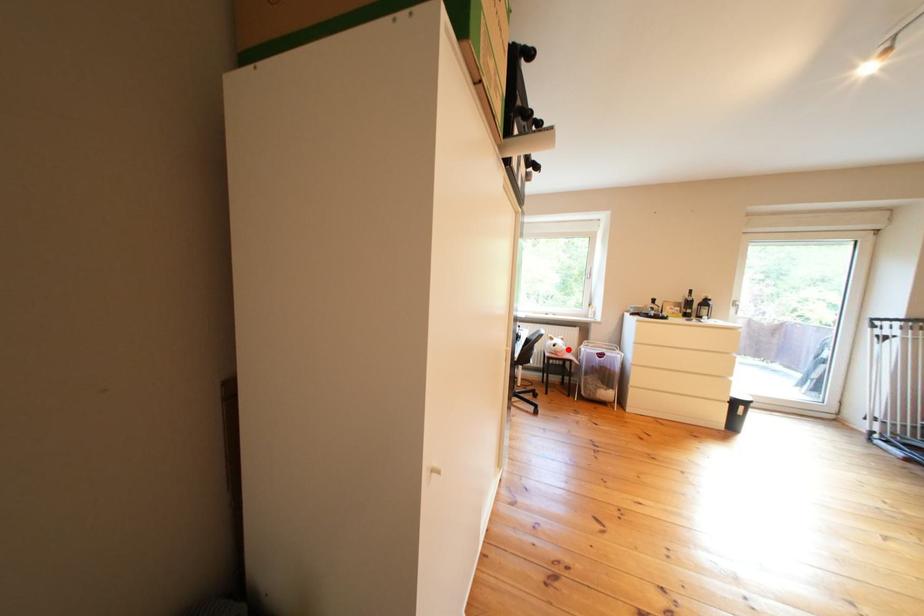
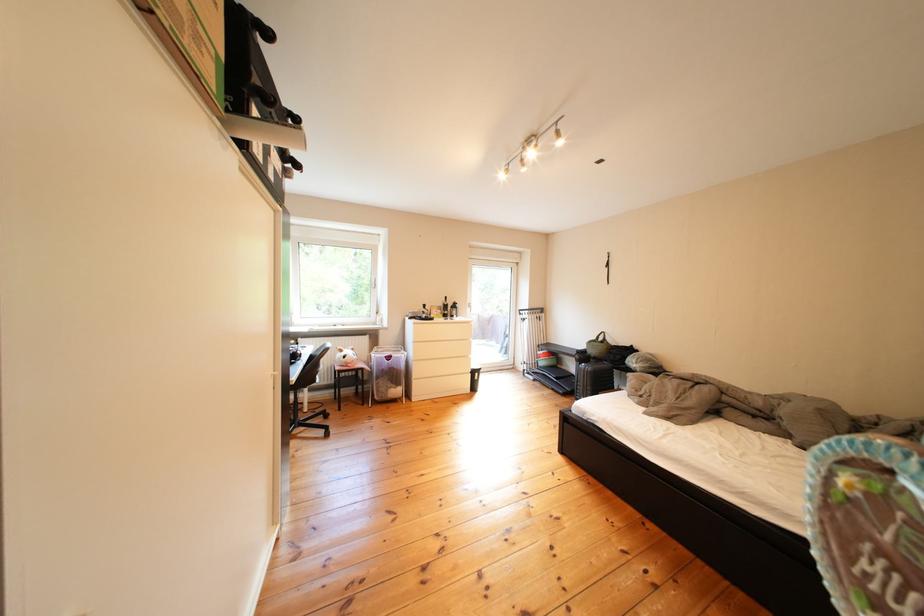
Question: I am providing you with two images of the same scene from different viewpoints. In image1, a red point is highlighted. Considering the same 3D point in image2, which of the following is correct?

Choices:
 (A) It is closer
 (B) It is farther

Answer: (A)